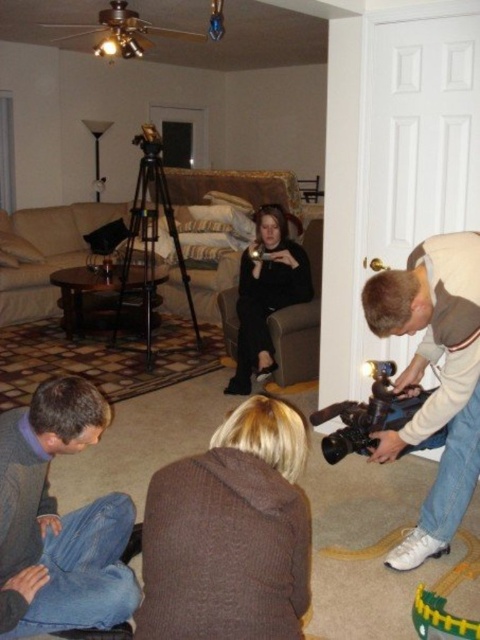
Question: Can you confirm if brown fuzzy sweater at lower center is positioned to the left of black metal tripod at center?

Choices:
 (A) yes
 (B) no

Answer: (B)

Question: Which is nearer to the black matte video camera at lower right?

Choices:
 (A) white leather camera at lower right
 (B) blue denim jeans at lower left
 (C) black metal tripod at center

Answer: (A)

Question: Which object is farther from the camera taking this photo?

Choices:
 (A) black metal tripod at center
 (B) brown fuzzy sweater at lower center
 (C) white leather camera at lower right

Answer: (A)

Question: Does black matte dress at center appear on the right side of black metal tripod at center?

Choices:
 (A) yes
 (B) no

Answer: (A)

Question: Which object is the farthest from the black matte video camera at lower right?

Choices:
 (A) blue denim jeans at lower left
 (B) black metal tripod at center
 (C) black matte dress at center
 (D) white leather camera at lower right

Answer: (B)

Question: Is black matte dress at center above black metal tripod at center?

Choices:
 (A) yes
 (B) no

Answer: (B)